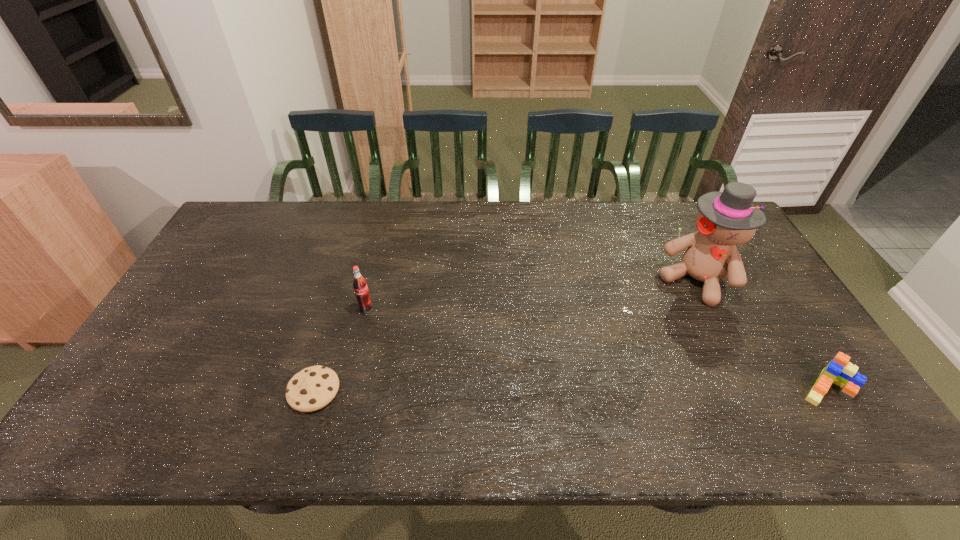
Image resolution: width=960 pixels, height=540 pixels. What are the coordinates of `free space at the near edge of the desktop` in the screenshot? It's located at (448, 400).

The width and height of the screenshot is (960, 540). I want to click on free space at the left edge of the desktop, so click(x=214, y=257).

At what (x,y) coordinates should I click in order to perform the action: click on free space at the right edge of the desktop. Please return your answer as a coordinate pair (x, y). Looking at the image, I should click on (801, 366).

You are a GUI agent. You are given a task and a screenshot of the screen. Output one action in this format:
    pyautogui.click(x=<x>, y=<y>)
    Task: Click on the free region at the far left corner of the desktop
    
    Given the screenshot: What is the action you would take?
    pyautogui.click(x=252, y=238)

Where is `free spot between the Lego and the soda bottle`? Image resolution: width=960 pixels, height=540 pixels. free spot between the Lego and the soda bottle is located at coordinates (596, 348).

In order to click on unoccupied area between the tallest object and the third shortest object in this screenshot , I will do `click(531, 295)`.

Image resolution: width=960 pixels, height=540 pixels. What are the coordinates of `free space between the rightmost object and the cookie` in the screenshot? It's located at (570, 389).

Where is `vacant point located between the shortest object and the second tallest object`? vacant point located between the shortest object and the second tallest object is located at coordinates (340, 350).

This screenshot has height=540, width=960. Find the location of `vacant area that lies between the tallest object and the cookie`. vacant area that lies between the tallest object and the cookie is located at coordinates (505, 336).

You are a GUI agent. You are given a task and a screenshot of the screen. Output one action in this format:
    pyautogui.click(x=<x>, y=<y>)
    Task: Click on the vacant point located between the tallest object and the second shortest object
    Image resolution: width=960 pixels, height=540 pixels.
    Given the screenshot: What is the action you would take?
    pyautogui.click(x=761, y=334)